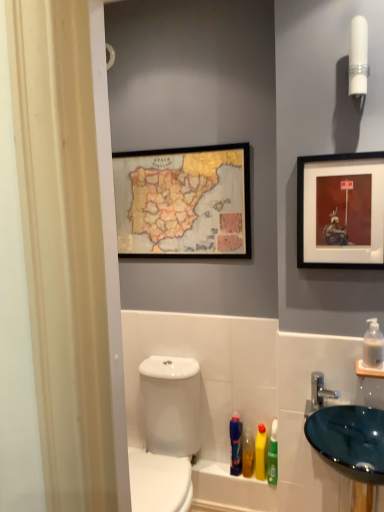
Question: Is white plastic tube at upper right positioned behind clear plastic pump at right, the fourth mouthwash from the bottom?

Choices:
 (A) no
 (B) yes

Answer: (A)

Question: Considering the relative sizes of white plastic tube at upper right and clear plastic pump at right, the fourth mouthwash from the bottom, in the image provided, is white plastic tube at upper right thinner than clear plastic pump at right, the fourth mouthwash from the bottom,?

Choices:
 (A) no
 (B) yes

Answer: (B)

Question: Is white plastic tube at upper right placed right next to clear plastic pump at right, the first mouthwash in the front-to-back sequence?

Choices:
 (A) yes
 (B) no

Answer: (B)

Question: Is white plastic tube at upper right not near clear plastic pump at right, the first mouthwash in the front-to-back sequence?

Choices:
 (A) no
 (B) yes

Answer: (A)

Question: Does white plastic tube at upper right have a smaller size compared to clear plastic pump at right, the fourth mouthwash in the left-to-right sequence?

Choices:
 (A) yes
 (B) no

Answer: (B)

Question: Looking at the image, does white glossy toilet at lower left seem bigger or smaller compared to yellow matte bottle at lower center?

Choices:
 (A) small
 (B) big

Answer: (B)

Question: From a real-world perspective, relative to yellow matte bottle at lower center, is white glossy toilet at lower left vertically above or below?

Choices:
 (A) above
 (B) below

Answer: (B)

Question: Considering the positions of point (198, 421) and point (259, 437), is point (198, 421) closer or farther from the camera than point (259, 437)?

Choices:
 (A) closer
 (B) farther

Answer: (B)

Question: Would you say white glossy toilet at lower left is to the left or to the right of yellow matte bottle at lower center in the picture?

Choices:
 (A) left
 (B) right

Answer: (A)

Question: Do you think glossy glass sink at lower right is within yellow matte bottle at lower center, or outside of it?

Choices:
 (A) inside
 (B) outside

Answer: (B)

Question: Is glossy glass sink at lower right to the left or to the right of yellow matte bottle at lower center in the image?

Choices:
 (A) left
 (B) right

Answer: (B)

Question: From their relative heights in the image, would you say glossy glass sink at lower right is taller or shorter than yellow matte bottle at lower center?

Choices:
 (A) short
 (B) tall

Answer: (B)

Question: From a real-world perspective, is glossy glass sink at lower right positioned above or below yellow matte bottle at lower center?

Choices:
 (A) below
 (B) above

Answer: (B)

Question: Is yellow matte bottle at lower center taller or shorter than matte black picture frame at upper right, acting as the second picture frame starting from the back?

Choices:
 (A) short
 (B) tall

Answer: (A)

Question: Is yellow matte bottle at lower center inside or outside of matte black picture frame at upper right, which is the first picture frame from right to left?

Choices:
 (A) outside
 (B) inside

Answer: (A)